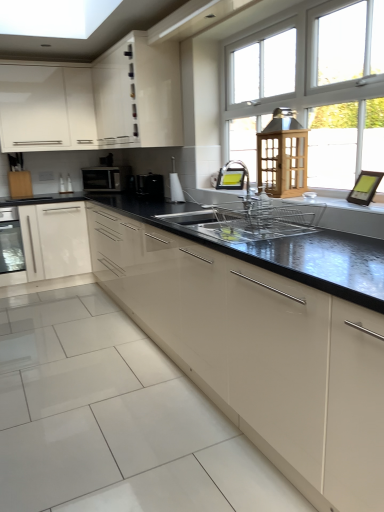
Question: From the image's perspective, does satin nickel faucet at center, placed as the 2th faucet when sorted from front to back, appear higher than satin black microwave at upper left?

Choices:
 (A) no
 (B) yes

Answer: (A)

Question: Is the surface of satin nickel faucet at center, marked as the first faucet in a back-to-front arrangement, in direct contact with satin black microwave at upper left?

Choices:
 (A) yes
 (B) no

Answer: (B)

Question: Is satin nickel faucet at center, placed as the 2th faucet when sorted from front to back, facing away from satin black microwave at upper left?

Choices:
 (A) yes
 (B) no

Answer: (B)

Question: Are satin nickel faucet at center, placed as the 2th faucet when sorted from front to back, and satin black microwave at upper left located far from each other?

Choices:
 (A) no
 (B) yes

Answer: (B)

Question: From the image's perspective, is satin nickel faucet at center, marked as the first faucet in a back-to-front arrangement, under satin black microwave at upper left?

Choices:
 (A) no
 (B) yes

Answer: (B)

Question: Based on their sizes in the image, would you say satin black microwave at upper left is bigger or smaller than white glossy cabinet at upper left, arranged as the first cabinetry when viewed from the top?

Choices:
 (A) small
 (B) big

Answer: (A)

Question: From a real-world perspective, is satin black microwave at upper left positioned above or below white glossy cabinet at upper left, the 4th cabinetry when ordered from bottom to top?

Choices:
 (A) below
 (B) above

Answer: (A)

Question: Is satin black microwave at upper left inside the boundaries of white glossy cabinet at upper left, the 4th cabinetry when ordered from bottom to top, or outside?

Choices:
 (A) inside
 (B) outside

Answer: (B)

Question: Is satin black microwave at upper left in front of or behind white glossy cabinet at upper left, the 4th cabinetry when ordered from bottom to top, in the image?

Choices:
 (A) behind
 (B) front

Answer: (A)

Question: Considering their positions, is matte glass oven at left located in front of or behind satin nickel faucet at center, positioned as the first faucet in front-to-back order?

Choices:
 (A) behind
 (B) front

Answer: (A)

Question: Is matte glass oven at left taller or shorter than satin nickel faucet at center, which is the 2th faucet in back-to-front order?

Choices:
 (A) short
 (B) tall

Answer: (B)

Question: From the image's perspective, relative to satin nickel faucet at center, which is the 2th faucet in back-to-front order, is matte glass oven at left above or below?

Choices:
 (A) below
 (B) above

Answer: (A)

Question: Is matte glass oven at left to the left or to the right of satin nickel faucet at center, positioned as the first faucet in front-to-back order, in the image?

Choices:
 (A) right
 (B) left

Answer: (B)

Question: In the image, is satin black microwave at upper left on the left side or the right side of glossy cream cabinet at center, which ranks as the 1th cabinetry in bottom-to-top order?

Choices:
 (A) right
 (B) left

Answer: (B)

Question: From a real-world perspective, is satin black microwave at upper left positioned above or below glossy cream cabinet at center, the 4th cabinetry viewed from the top?

Choices:
 (A) above
 (B) below

Answer: (A)